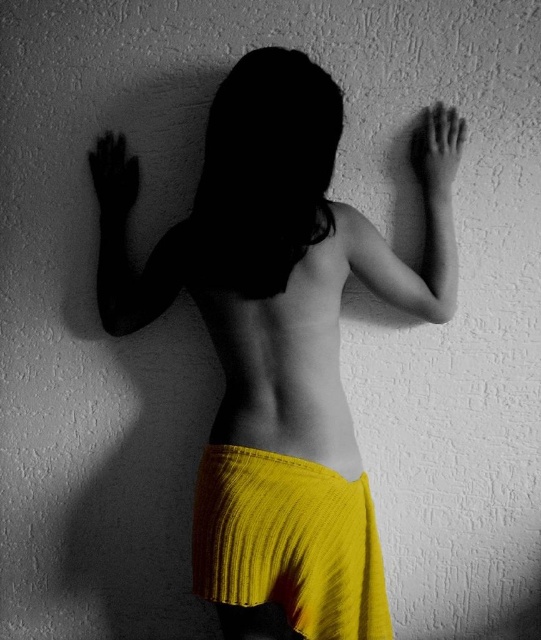
Question: Can you confirm if black matte arm at upper left is positioned to the right of smooth skin hand at upper right?

Choices:
 (A) no
 (B) yes

Answer: (A)

Question: Which object is the closest to the smooth skin arm at upper center?

Choices:
 (A) yellow pleated skirt at center
 (B) black matte hand at left
 (C) black matte arm at upper left

Answer: (A)

Question: Which object is farther from the camera taking this photo?

Choices:
 (A) black matte hand at left
 (B) smooth skin hand at upper right
 (C) yellow knitted skirt at center
 (D) smooth skin arm at upper center

Answer: (A)

Question: Does yellow pleated skirt at center appear under smooth skin arm at upper center?

Choices:
 (A) yes
 (B) no

Answer: (A)

Question: Which point is closer to the camera taking this photo?

Choices:
 (A) (293, 472)
 (B) (385, 278)
 (C) (424, 157)

Answer: (A)

Question: Does yellow knitted skirt at center have a larger size compared to black matte hand at left?

Choices:
 (A) yes
 (B) no

Answer: (A)